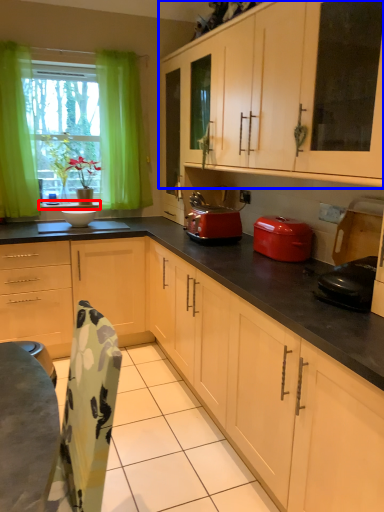
Question: Which object appears farthest to the camera in this image, window sill (highlighted by a red box) or cabinetry (highlighted by a blue box)?

Choices:
 (A) window sill
 (B) cabinetry

Answer: (A)